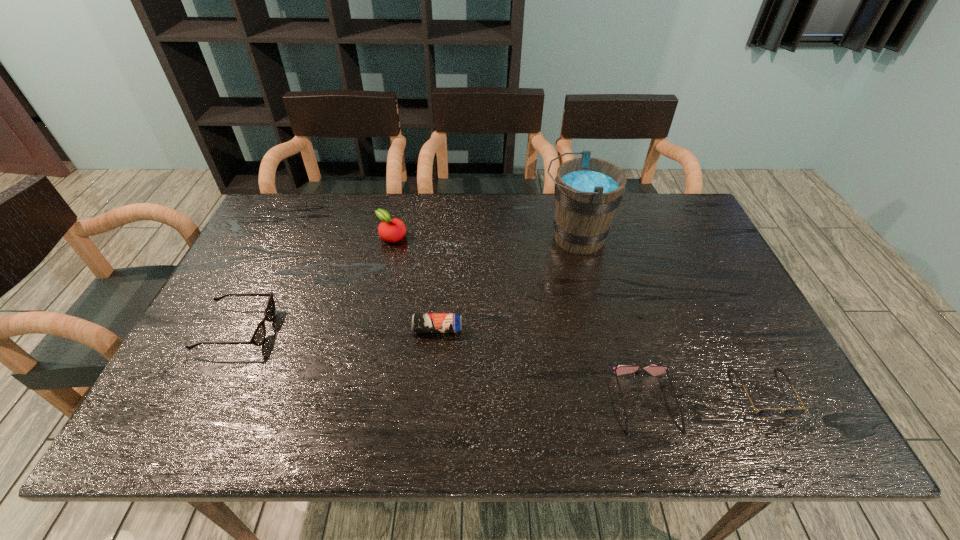
Locate an element on the screen. free space at the far edge is located at coordinates (463, 225).

In the image, there is a desktop. Where is `vacant region at the near edge`? The height and width of the screenshot is (540, 960). vacant region at the near edge is located at coordinates (725, 424).

The height and width of the screenshot is (540, 960). Find the location of `vacant space at the left edge of the desktop`. vacant space at the left edge of the desktop is located at coordinates (181, 363).

Where is `vacant space at the right edge of the desktop`? The image size is (960, 540). vacant space at the right edge of the desktop is located at coordinates (681, 282).

Identify the location of vacant space at the far left corner of the desktop. This screenshot has height=540, width=960. (286, 203).

Locate an element on the screen. empty location between the shortest sunglasses and the wine bucket is located at coordinates (670, 315).

Find the location of `free space that is in between the fourth object from right to left and the second object from left to right`. free space that is in between the fourth object from right to left and the second object from left to right is located at coordinates coord(415,282).

Image resolution: width=960 pixels, height=540 pixels. I want to click on vacant region between the rightmost object and the third object from left to right, so click(x=601, y=361).

Where is `free space between the rightmost object and the second tallest sunglasses`? The height and width of the screenshot is (540, 960). free space between the rightmost object and the second tallest sunglasses is located at coordinates (706, 397).

The height and width of the screenshot is (540, 960). Identify the location of free spot between the second shortest sunglasses and the leftmost object. (442, 366).